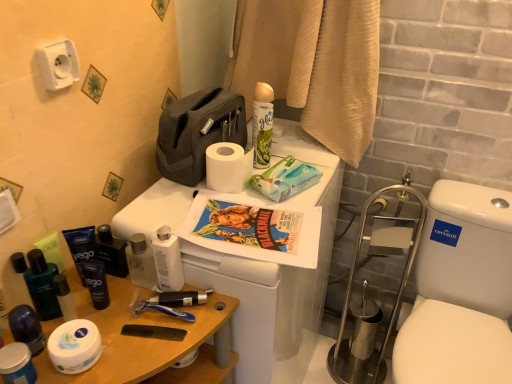
Question: Based on their sizes in the image, would you say shiny black bottles at lower left, marked as the 7th toiletry in a right-to-left arrangement, is bigger or smaller than wooden table at lower left?

Choices:
 (A) small
 (B) big

Answer: (A)

Question: From the image's perspective, is shiny black bottles at lower left, marked as the 7th toiletry in a right-to-left arrangement, positioned above or below wooden table at lower left?

Choices:
 (A) above
 (B) below

Answer: (A)

Question: Which object is the farthest from the matte white jar at lower left, the 5th toiletry viewed from the right?

Choices:
 (A) shiny black bottles at lower left, marked as the 7th toiletry in a right-to-left arrangement
 (B) white matte toilet paper at lower left, which ranks as the 2th toilet paper in right-to-left order
 (C) white plastic toilet at upper center
 (D) matte black shaving cream at left, positioned as the sixth toiletry in right-to-left order
 (E) dark blue matte tube at left, marked as the 2th toiletry in a right-to-left arrangement

Answer: (C)

Question: Which object is positioned closest to the green matte spray can at upper center?

Choices:
 (A) matte white jar at lower left, placed as the third toiletry when sorted from left to right
 (B) dark blue matte tube at left, which ranks as the sixth toiletry in left-to-right order
 (C) wooden table at lower left
 (D) white matte toilet paper at lower left, the 1th toilet paper in the left-to-right sequence
 (E) white paper towels at center

Answer: (E)